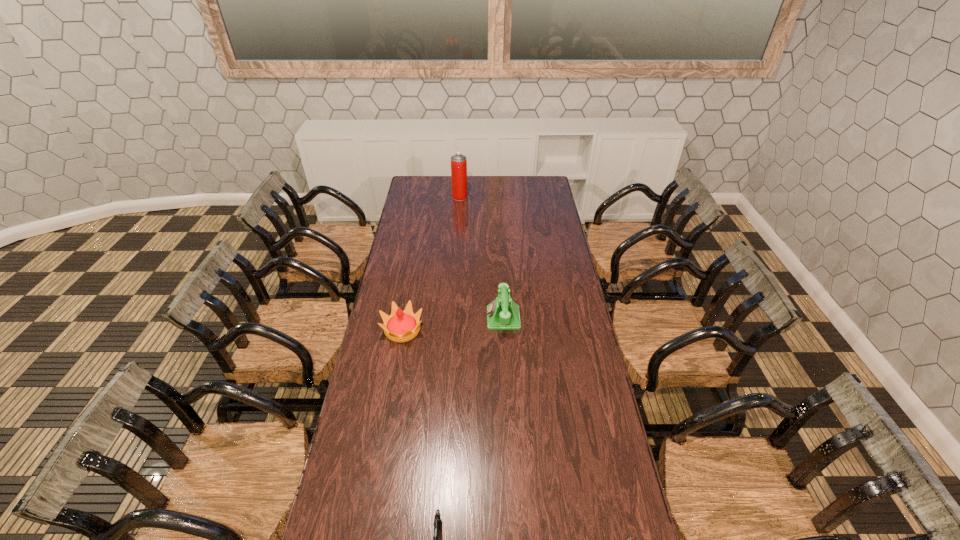
Identify the location of object situated at the left edge. [401, 326].

Identify the location of free region at the left edge of the desktop. This screenshot has height=540, width=960. (415, 237).

You are a GUI agent. You are given a task and a screenshot of the screen. Output one action in this format:
    pyautogui.click(x=<x>, y=<y>)
    Task: Click on the vacant region at the right edge of the desktop
    
    Given the screenshot: What is the action you would take?
    pyautogui.click(x=572, y=325)

Where is `vacant space at the far left corner of the desktop`? The width and height of the screenshot is (960, 540). vacant space at the far left corner of the desktop is located at coordinates (425, 192).

I want to click on free point between the telephone and the crown, so tap(453, 324).

Identify which object is the third nearest to the gun. Please provide its 2D coordinates. Your answer should be formatted as a tuple, i.e. [(x, y)], where the tuple contains the x and y coordinates of a point satisfying the conditions above.

[(503, 313)]

Choose which object is the fourth nearest neighbor to the second shortest object. Please provide its 2D coordinates. Your answer should be formatted as a tuple, i.e. [(x, y)], where the tuple contains the x and y coordinates of a point satisfying the conditions above.

[(458, 162)]

Where is `vacant region that satisfies the following two spatial constraints: 1. on the back side of the tallest object; 2. on the left side of the leftmost object`? vacant region that satisfies the following two spatial constraints: 1. on the back side of the tallest object; 2. on the left side of the leftmost object is located at coordinates (426, 197).